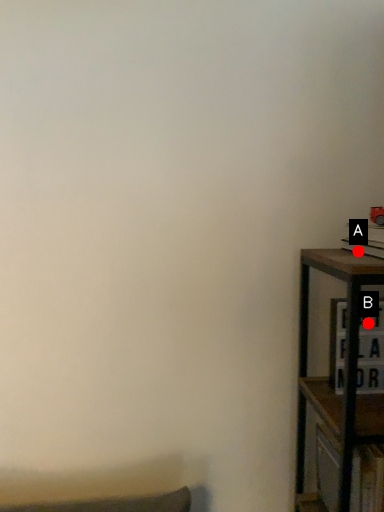
Question: Two points are circled on the image, labeled by A and B beside each circle. Which point appears closest to the camera in this image?

Choices:
 (A) A is closer
 (B) B is closer

Answer: (A)